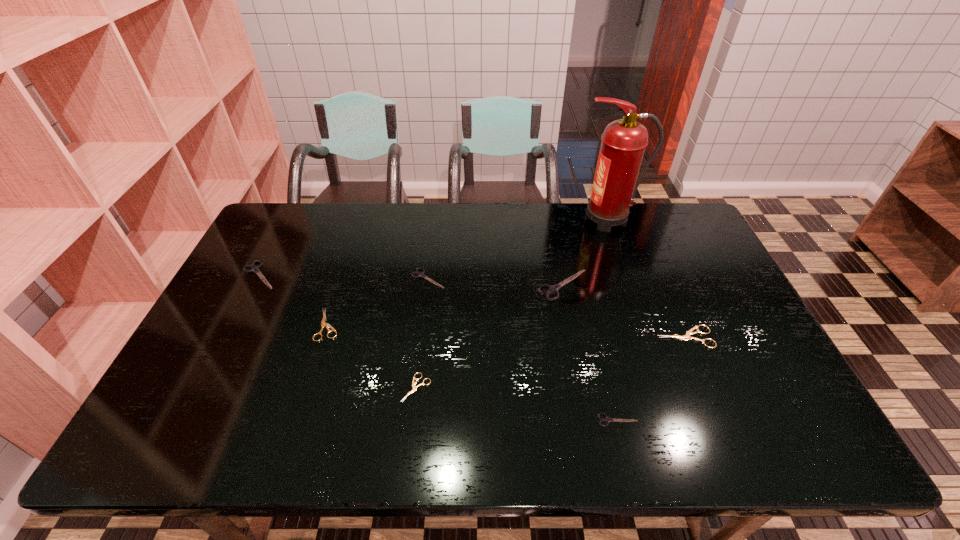
This screenshot has width=960, height=540. Identify the location of vacant area that lies between the second biggest beige shears and the nearest black shears. (473, 372).

Where is `empty space that is in between the second biggest beige shears and the sixth farthest shears`? The height and width of the screenshot is (540, 960). empty space that is in between the second biggest beige shears and the sixth farthest shears is located at coordinates (372, 356).

At what (x,y) coordinates should I click in order to perform the action: click on vacant space in between the sixth shears from right to left and the tallest shears. Please return your answer as a coordinate pair (x, y). The image size is (960, 540). Looking at the image, I should click on (445, 305).

In order to click on vacant area that lies between the leftmost beige shears and the red fire extinguisher in this screenshot , I will do `click(468, 272)`.

Point out which object is positioned as the third nearest to the rightmost shears. Please provide its 2D coordinates. Your answer should be formatted as a tuple, i.e. [(x, y)], where the tuple contains the x and y coordinates of a point satisfying the conditions above.

[(623, 142)]

Locate an element on the screen. Image resolution: width=960 pixels, height=540 pixels. object that is the closest one to the second beige shears from left to right is located at coordinates (323, 324).

Identify which shears is the closest to the third smallest black shears. Please provide its 2D coordinates. Your answer should be formatted as a tuple, i.e. [(x, y)], where the tuple contains the x and y coordinates of a point satisfying the conditions above.

[(323, 324)]

Identify which shears is the third closest to the seventh shortest object. Please provide its 2D coordinates. Your answer should be formatted as a tuple, i.e. [(x, y)], where the tuple contains the x and y coordinates of a point satisfying the conditions above.

[(606, 419)]

Identify which black shears is located as the third nearest to the smallest beige shears. Please provide its 2D coordinates. Your answer should be formatted as a tuple, i.e. [(x, y)], where the tuple contains the x and y coordinates of a point satisfying the conditions above.

[(606, 419)]

Locate which black shears ranks second in proximity to the leftmost shears. Please provide its 2D coordinates. Your answer should be formatted as a tuple, i.e. [(x, y)], where the tuple contains the x and y coordinates of a point satisfying the conditions above.

[(554, 289)]